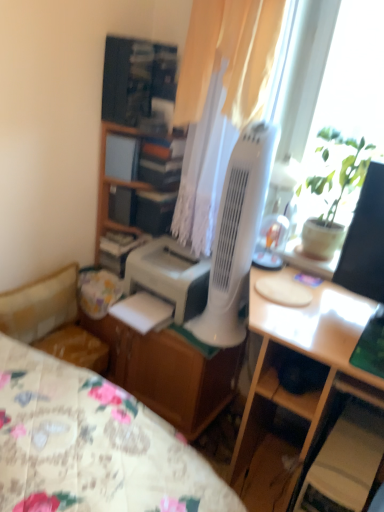
Question: Is wooden file cabinet at center bigger than wooden bookshelf at upper center?

Choices:
 (A) no
 (B) yes

Answer: (B)

Question: Does wooden file cabinet at center contain wooden bookshelf at upper center?

Choices:
 (A) no
 (B) yes

Answer: (A)

Question: Is wooden file cabinet at center oriented away from wooden bookshelf at upper center?

Choices:
 (A) no
 (B) yes

Answer: (A)

Question: Is wooden file cabinet at center further to the viewer compared to wooden bookshelf at upper center?

Choices:
 (A) no
 (B) yes

Answer: (A)

Question: From the image's perspective, would you say wooden file cabinet at center is positioned over wooden bookshelf at upper center?

Choices:
 (A) yes
 (B) no

Answer: (B)

Question: Does wooden file cabinet at center have a greater height compared to wooden bookshelf at upper center?

Choices:
 (A) yes
 (B) no

Answer: (A)

Question: Is white plastic mechanical fan at center positioned behind wooden bookshelf at upper center?

Choices:
 (A) no
 (B) yes

Answer: (A)

Question: Is white plastic mechanical fan at center oriented towards wooden bookshelf at upper center?

Choices:
 (A) no
 (B) yes

Answer: (A)

Question: Considering the relative sizes of white plastic mechanical fan at center and wooden bookshelf at upper center in the image provided, is white plastic mechanical fan at center shorter than wooden bookshelf at upper center?

Choices:
 (A) yes
 (B) no

Answer: (B)

Question: Is white plastic mechanical fan at center outside of wooden bookshelf at upper center?

Choices:
 (A) no
 (B) yes

Answer: (B)

Question: Is white plastic mechanical fan at center taller than wooden bookshelf at upper center?

Choices:
 (A) yes
 (B) no

Answer: (A)

Question: Is white plastic mechanical fan at center to the left of wooden bookshelf at upper center from the viewer's perspective?

Choices:
 (A) yes
 (B) no

Answer: (B)

Question: From a real-world perspective, is white matte printer at center over light wood desk at center?

Choices:
 (A) yes
 (B) no

Answer: (A)